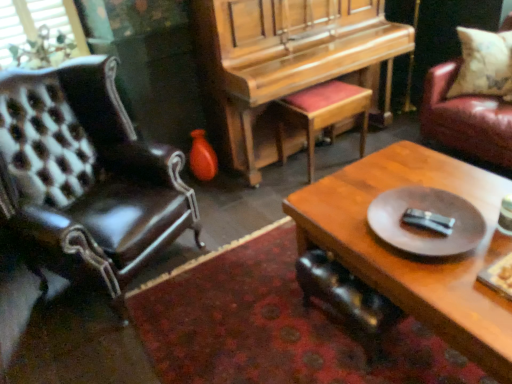
Identify the location of free spot to the left of velvet red stool at center. (269, 184).